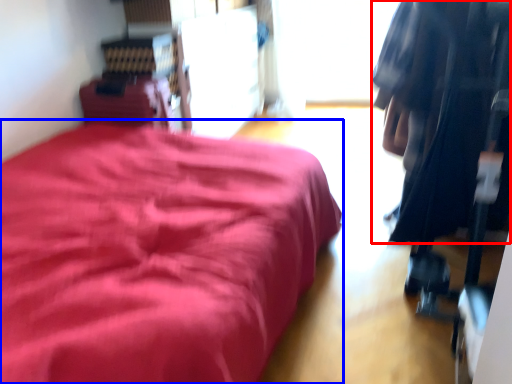
Question: Which object is further to the camera taking this photo, clothing (highlighted by a red box) or furniture (highlighted by a blue box)?

Choices:
 (A) clothing
 (B) furniture

Answer: (A)